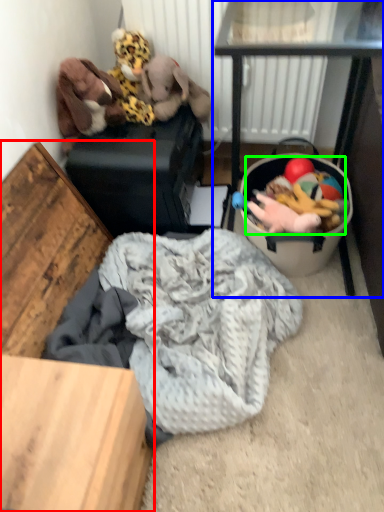
Question: Which is nearer to the furniture (highlighted by a red box)? table (highlighted by a blue box) or stuff (highlighted by a green box).

Choices:
 (A) table
 (B) stuff

Answer: (B)